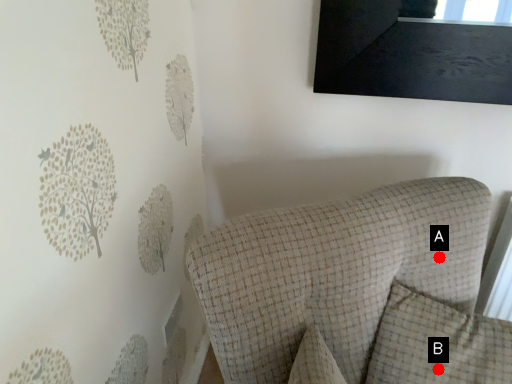
Question: Two points are circled on the image, labeled by A and B beside each circle. Which point is further to the camera?

Choices:
 (A) A is further
 (B) B is further

Answer: (A)